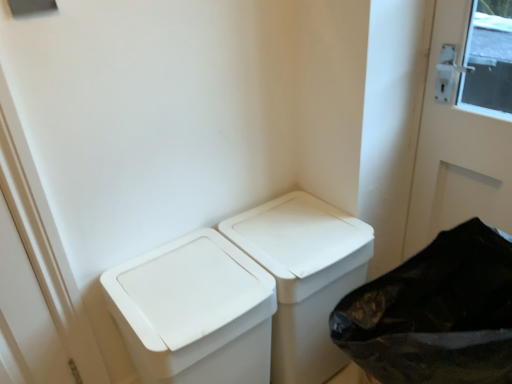
In order to click on free space above white plastic waste container at center, the second waste container viewed from the right (from a real-world perspective) in this screenshot , I will do `click(183, 282)`.